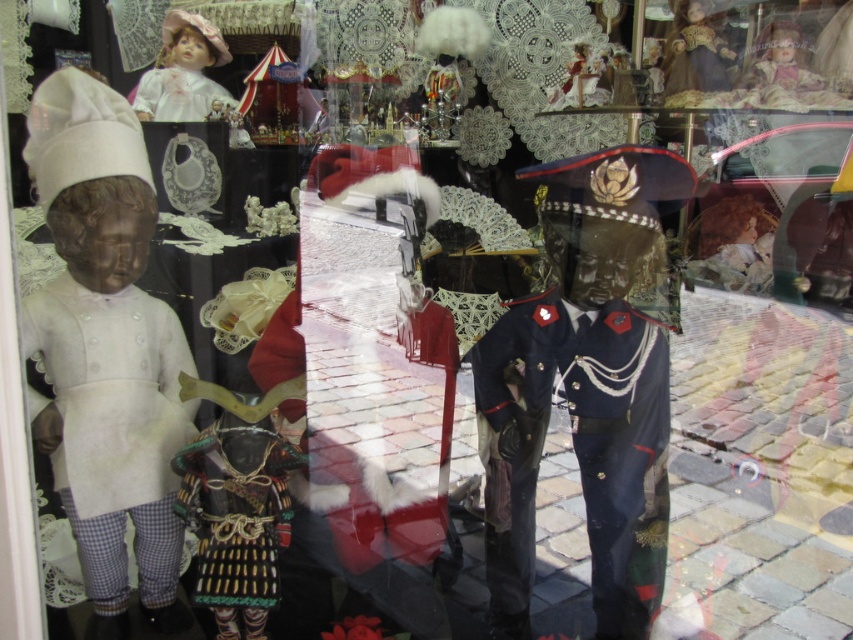
You are a costume designer preparing for a play. You have two white dresses available for the lead character. One is a white matte fabric at left and the other is a white lace dress at upper left. The director wants the dress with the wider silhouette. Which one should you choose?

The white matte fabric at left has a larger width than the white lace dress at upper left, so you should choose the white matte fabric at left for the wider silhouette.

Based on the scene description, where is the white matte fabric at left located in the display window? Please provide coordinates.

The white matte fabric at left is located at point (112, 413).